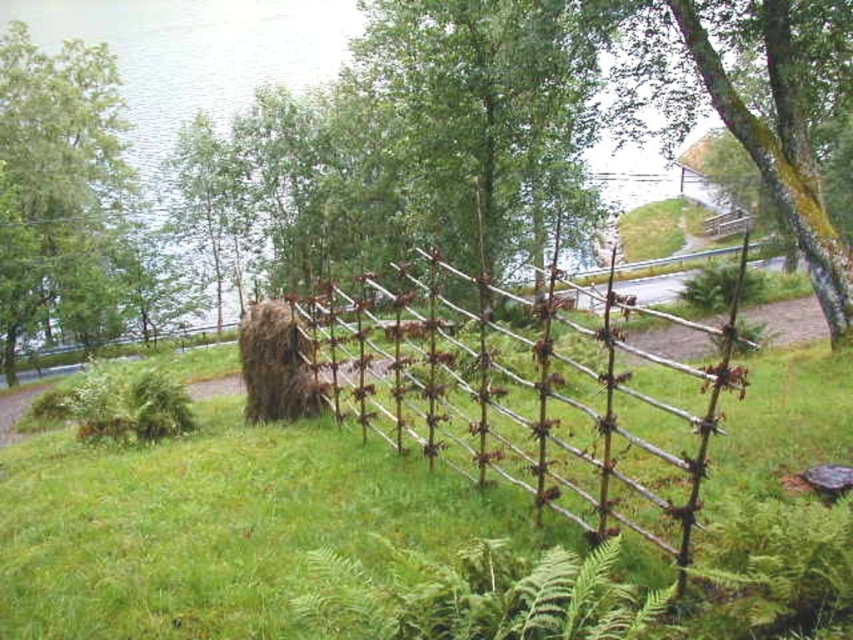
Question: Is green leafy tree at upper left positioned in front of brown grassy hay at center?

Choices:
 (A) yes
 (B) no

Answer: (B)

Question: Is green grassy at center in front of brown wooden fence at center?

Choices:
 (A) yes
 (B) no

Answer: (B)

Question: Which point appears closest to the camera in this image?

Choices:
 (A) [x=296, y=396]
 (B) [x=0, y=177]

Answer: (A)

Question: Which point is closer to the camera?

Choices:
 (A) (747, 340)
 (B) (244, 371)
 (C) (828, 445)

Answer: (C)

Question: Can you confirm if green grassy at center is positioned to the left of green leafy tree at upper left?

Choices:
 (A) yes
 (B) no

Answer: (B)

Question: Which object appears farthest from the camera in this image?

Choices:
 (A) brown wooden fence at center
 (B) green grassy at center

Answer: (B)